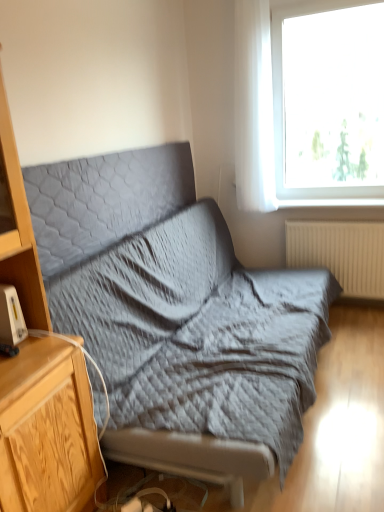
Question: From a real-world perspective, is textured gray fabric studio couch at center positioned above or below wooden cabinet at left?

Choices:
 (A) below
 (B) above

Answer: (A)

Question: Is textured gray fabric studio couch at center wider or thinner than wooden cabinet at left?

Choices:
 (A) thin
 (B) wide

Answer: (B)

Question: Which object is positioned farthest from the textured gray fabric studio couch at center?

Choices:
 (A) white plastic gadget at left
 (B) wooden cabinet at left
 (C) transparent glass window at upper right
 (D) gray quilted pillow at upper center
 (E) beige ribbed radiator at lower right

Answer: (C)

Question: Which of these objects is positioned farthest from the white plastic gadget at left?

Choices:
 (A) wooden cabinet at left
 (B) transparent glass window at upper right
 (C) gray quilted pillow at upper center
 (D) beige ribbed radiator at lower right
 (E) textured gray fabric studio couch at center

Answer: (D)